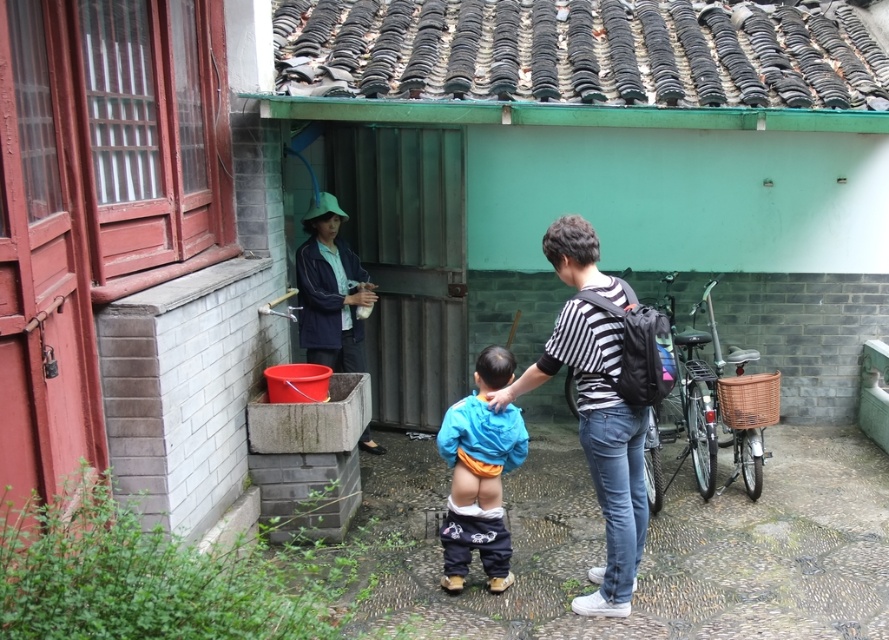
Question: Does blue fabric jacket at center appear under blue denim jacket at left?

Choices:
 (A) no
 (B) yes

Answer: (B)

Question: Is green painted brick wall at center wider than blue fabric jacket at center?

Choices:
 (A) no
 (B) yes

Answer: (B)

Question: Considering the real-world distances, which object is closest to the smooth concrete wall at lower left?

Choices:
 (A) blue cotton jacket at center
 (B) blue fabric jacket at center

Answer: (A)

Question: Based on their relative distances, which object is farther from the blue fabric jacket at center?

Choices:
 (A) green painted brick wall at center
 (B) smooth concrete wall at lower left
 (C) blue cotton jacket at center
 (D) blue denim jacket at left

Answer: (A)

Question: Which object is positioned closest to the blue denim jacket at left?

Choices:
 (A) green painted brick wall at center
 (B) smooth concrete wall at lower left

Answer: (B)

Question: Can you confirm if green painted brick wall at center is positioned above smooth concrete wall at lower left?

Choices:
 (A) yes
 (B) no

Answer: (A)